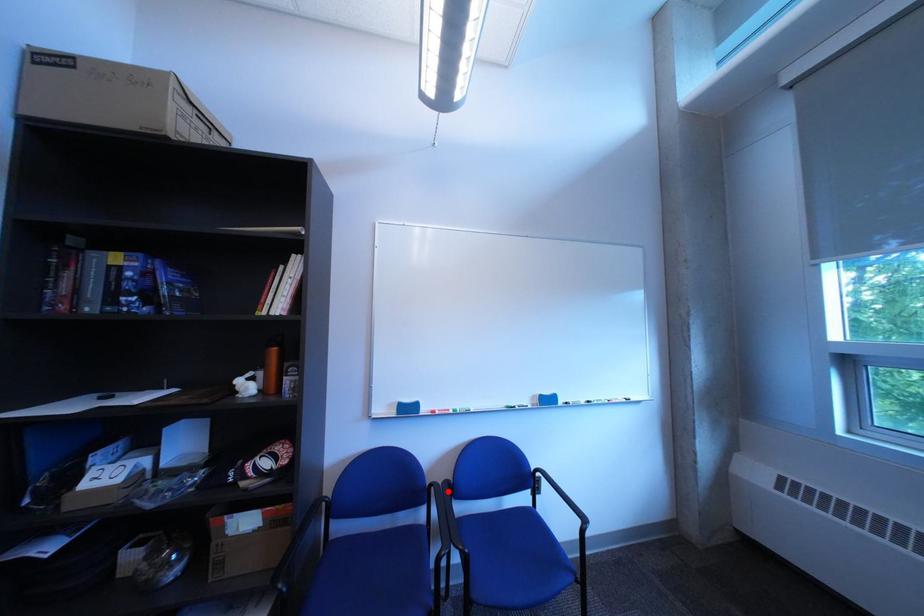
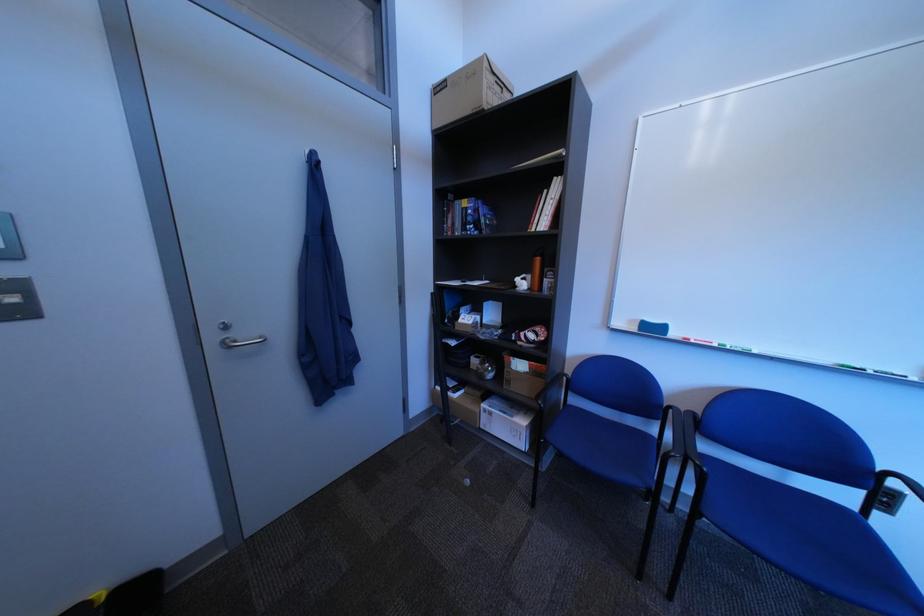
Find the pixel in the second image that matches the highlighted location in the first image.

(687, 413)